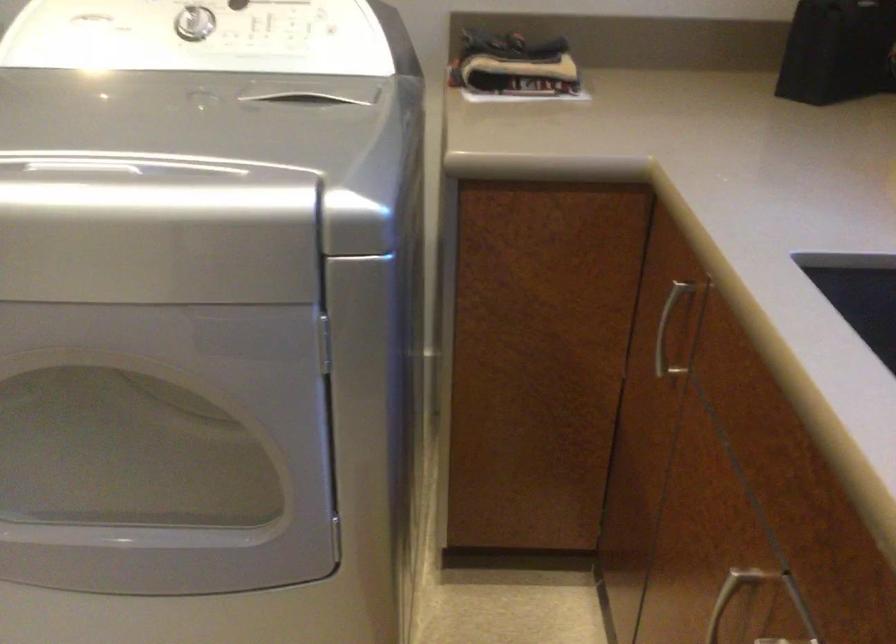
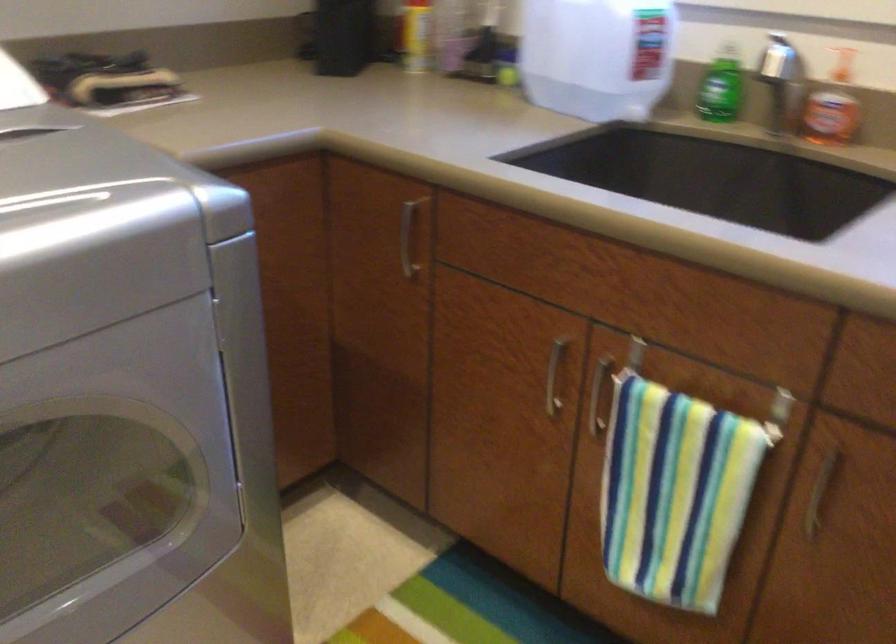
The point at (317, 124) is marked in the first image. Where is the corresponding point in the second image?

(73, 155)